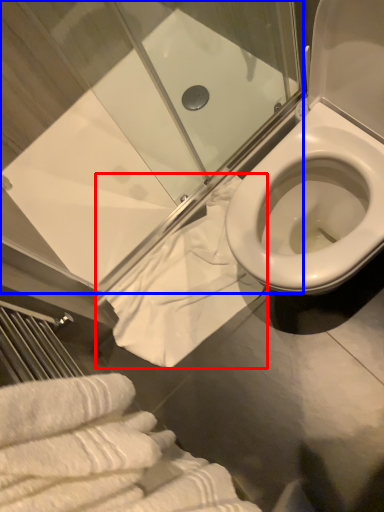
Question: Which object is further to the camera taking this photo, bath towel (highlighted by a red box) or shower door (highlighted by a blue box)?

Choices:
 (A) bath towel
 (B) shower door

Answer: (A)